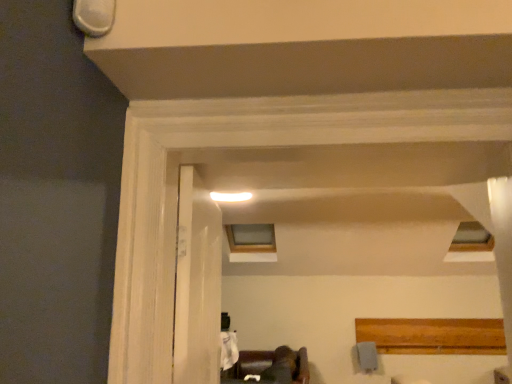
Question: Do you think clear glass window at upper center is within dark brown leather couch at lower center, or outside of it?

Choices:
 (A) inside
 (B) outside

Answer: (B)

Question: From the image's perspective, is clear glass window at upper center positioned above or below dark brown leather couch at lower center?

Choices:
 (A) below
 (B) above

Answer: (B)

Question: Based on their relative distances, which object is farther from the dark brown leather couch at lower center?

Choices:
 (A) clear glass window at upper center
 (B) white wood door at center

Answer: (B)

Question: Estimate the real-world distances between objects in this image. Which object is closer to the clear glass window at upper center?

Choices:
 (A) white wood door at center
 (B) dark brown leather couch at lower center

Answer: (B)